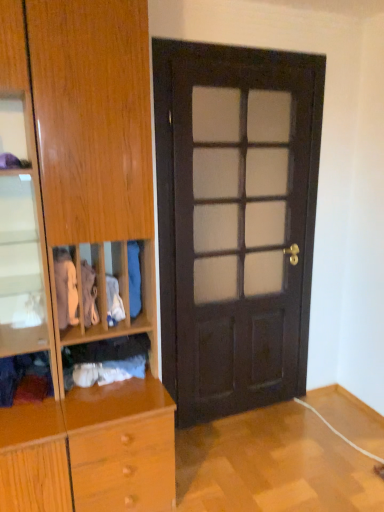
Question: In terms of size, does white cotton shirt at left, which appears as the 2th clothing when viewed from the left, appear bigger or smaller than velvet purple scarf at lower left, placed as the 1th clothing when sorted from left to right?

Choices:
 (A) small
 (B) big

Answer: (A)

Question: From the image's perspective, is white cotton shirt at left, which is the fifth clothing from right to left, positioned above or below velvet purple scarf at lower left, the sixth clothing viewed from the right?

Choices:
 (A) above
 (B) below

Answer: (A)

Question: Considering the real-world distances, which object is closest to the white cotton shirt at center, which is the fifth clothing from left to right?

Choices:
 (A) wooden cabinet at left
 (B) blue fabric at center, the sixth clothing from the left
 (C) dark wood door at center
 (D) white cotton shirt at left, which is the fifth clothing from right to left
 (E) velvet purple scarf at lower left, the sixth clothing viewed from the right

Answer: (B)

Question: Estimate the real-world distances between objects in this image. Which object is closer to the white cotton shirt at center, the 2th clothing positioned from the right?

Choices:
 (A) white cotton shirt at left, which is the fifth clothing from right to left
 (B) velvet purple scarf at lower left, the sixth clothing viewed from the right
 (C) dark wood door at center
 (D) blue fabric at center, the 1th clothing positioned from the right
 (E) wooden cabinet at left

Answer: (D)